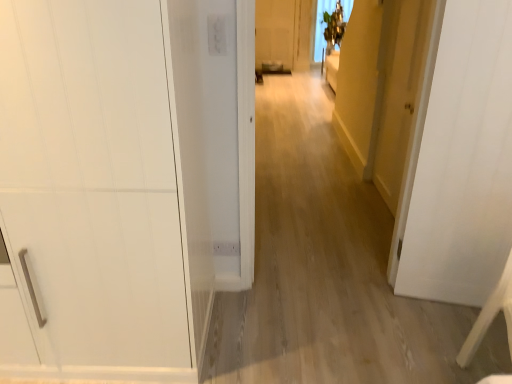
Locate an element on the screen. The width and height of the screenshot is (512, 384). vacant position to the left of yellow matte door at right, the first door when ordered from right to left is located at coordinates (346, 201).